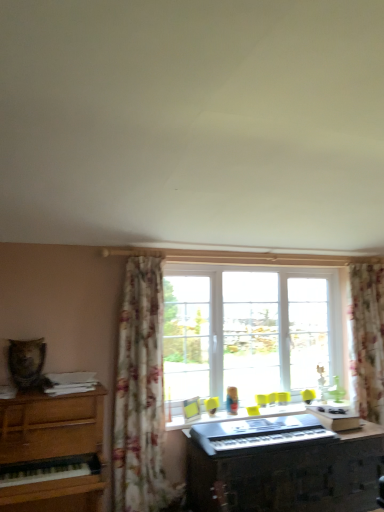
Measure the distance between point [134,438] and camera.

Point [134,438] and camera are 9.18 feet apart.

This screenshot has width=384, height=512. Describe the element at coordinates (257, 433) in the screenshot. I see `black plastic musical keyboard at center` at that location.

Describe the element at coordinates (51, 426) in the screenshot. I see `wooden piano at left` at that location.

Image resolution: width=384 pixels, height=512 pixels. In order to click on metallic silver keyboard at center in this screenshot , I will do `click(281, 466)`.

Find the location of a particular element. floral fabric curtain at right, the second curtain in the left-to-right sequence is located at coordinates coord(368,338).

Identify the location of floral fabric curtain at center, the first curtain from the front. (141, 394).

Is point (205, 328) closer to camera compared to point (134, 265)?

No, (205, 328) is further to viewer.

Could you tell me if clear glass window at center is facing floral fabric curtain at center, which is the 1th curtain in left-to-right order?

No.

Considering the sizes of objects clear glass window at center and floral fabric curtain at center, which appears as the second curtain when viewed from the right, in the image provided, who is wider, clear glass window at center or floral fabric curtain at center, which appears as the second curtain when viewed from the right,?

With larger width is clear glass window at center.

Is clear glass window at center inside or outside of floral fabric curtain at center, the 2th curtain positioned from the back?

clear glass window at center is not enclosed by floral fabric curtain at center, the 2th curtain positioned from the back.

Between metallic silver keyboard at center and clear glass window at center, which one has smaller size?

With smaller size is clear glass window at center.

Do you think metallic silver keyboard at center is within clear glass window at center, or outside of it?

metallic silver keyboard at center is outside clear glass window at center.

From a real-world perspective, is metallic silver keyboard at center on clear glass window at center?

Actually, metallic silver keyboard at center is physically below clear glass window at center in the real world.

What are the coordinates of `piano in front of the clear glass window at center` in the screenshot? It's located at (281, 466).

Does black plastic musical keyboard at center appear on the right side of wooden piano at left?

Correct, you'll find black plastic musical keyboard at center to the right of wooden piano at left.

Are black plastic musical keyboard at center and wooden piano at left located far from each other?

They are positioned close to each other.

Is black plastic musical keyboard at center positioned with its back to wooden piano at left?

That's not correct — black plastic musical keyboard at center is not looking away from wooden piano at left.

Can you confirm if black plastic musical keyboard at center is taller than wooden piano at left?

No.

Is metallic silver keyboard at center not close to floral fabric curtain at right, the first curtain in the right-to-left sequence?

Indeed, metallic silver keyboard at center is not near floral fabric curtain at right, the first curtain in the right-to-left sequence.

From the picture: Which of these two, metallic silver keyboard at center or floral fabric curtain at right, the second curtain in the left-to-right sequence, stands shorter?

Standing shorter between the two is metallic silver keyboard at center.

Is the position of metallic silver keyboard at center more distant than that of floral fabric curtain at right, the second curtain in the left-to-right sequence?

No.

Identify the location of piano below the floral fabric curtain at right, which ranks as the 2th curtain in front-to-back order (from a real-world perspective). (x=281, y=466).

Can wooden piano at left be found inside floral fabric curtain at center, the 2th curtain positioned from the back?

No, wooden piano at left is not surrounded by floral fabric curtain at center, the 2th curtain positioned from the back.

I want to click on cabinetry below the floral fabric curtain at center, which is the 1th curtain in left-to-right order (from the image's perspective), so click(x=51, y=426).

Is floral fabric curtain at center, the first curtain from the front, in front of or behind wooden piano at left in the image?

floral fabric curtain at center, the first curtain from the front, is behind wooden piano at left.

Considering the positions of points (40, 401) and (123, 466), is point (40, 401) closer to camera compared to point (123, 466)?

That is True.

From a real-world perspective, which object rests below the other?

wooden piano at left is physically lower.

Can you confirm if wooden piano at left is wider than floral fabric curtain at center, which is the 1th curtain in left-to-right order?

Indeed, wooden piano at left has a greater width compared to floral fabric curtain at center, which is the 1th curtain in left-to-right order.

From the image's perspective, which is below, wooden piano at left or floral fabric curtain at center, which appears as the second curtain when viewed from the right?

From the image's view, wooden piano at left is below.

Is clear glass window at center far from metallic silver keyboard at center?

No, clear glass window at center is not far away from metallic silver keyboard at center.

Is clear glass window at center shorter than metallic silver keyboard at center?

In fact, clear glass window at center may be taller than metallic silver keyboard at center.

Can you tell me how much clear glass window at center and metallic silver keyboard at center differ in facing direction?

The facing directions of clear glass window at center and metallic silver keyboard at center are 1.1 degrees apart.

Is clear glass window at center closer to the viewer compared to metallic silver keyboard at center?

That is False.

You are a GUI agent. You are given a task and a screenshot of the screen. Output one action in this format:
    pyautogui.click(x=<x>, y=<y>)
    Task: Click on the curtain below the clear glass window at center (from a real-world perspective)
    The width and height of the screenshot is (384, 512).
    Given the screenshot: What is the action you would take?
    pyautogui.click(x=141, y=394)

Identify the location of window above the metallic silver keyboard at center (from the image's perspective). (253, 331).

Looking at the image, which one is located further to black plastic musical keyboard at center, floral fabric curtain at right, the first curtain positioned from the back, or floral fabric curtain at center, the first curtain from the front?

Based on the image, floral fabric curtain at right, the first curtain positioned from the back, appears to be further to black plastic musical keyboard at center.

Which object lies further to the anchor point floral fabric curtain at center, the 2th curtain positioned from the back, floral fabric curtain at right, which ranks as the 2th curtain in front-to-back order, or clear glass window at center?

The object further to floral fabric curtain at center, the 2th curtain positioned from the back, is floral fabric curtain at right, which ranks as the 2th curtain in front-to-back order.

Based on the photo, considering their positions, is wooden piano at left positioned closer to floral fabric curtain at center, the 2th curtain positioned from the back, than clear glass window at center?

wooden piano at left lies closer to floral fabric curtain at center, the 2th curtain positioned from the back, than the other object.

Which object lies further to the anchor point floral fabric curtain at right, the first curtain positioned from the back, black plastic musical keyboard at center or metallic silver keyboard at center?

black plastic musical keyboard at center is positioned further to the anchor floral fabric curtain at right, the first curtain positioned from the back.

From the image, which object appears to be farther from clear glass window at center, floral fabric curtain at right, the second curtain in the left-to-right sequence, or floral fabric curtain at center, which appears as the second curtain when viewed from the right?

The object further to clear glass window at center is floral fabric curtain at center, which appears as the second curtain when viewed from the right.

From the image, which object appears to be nearer to metallic silver keyboard at center, black plastic musical keyboard at center or clear glass window at center?

The object closer to metallic silver keyboard at center is black plastic musical keyboard at center.

Looking at the image, which one is located closer to black plastic musical keyboard at center, clear glass window at center or floral fabric curtain at center, the first curtain from the front?

floral fabric curtain at center, the first curtain from the front, is closer to black plastic musical keyboard at center.

Based on their spatial positions, is metallic silver keyboard at center or floral fabric curtain at right, which ranks as the 2th curtain in front-to-back order, closer to clear glass window at center?

floral fabric curtain at right, which ranks as the 2th curtain in front-to-back order, is closer to clear glass window at center.

Locate an element on the screen. curtain situated between wooden piano at left and floral fabric curtain at right, the first curtain in the right-to-left sequence, from left to right is located at coordinates [141, 394].

Locate an element on the screen. This screenshot has width=384, height=512. window between floral fabric curtain at center, which is the 1th curtain in left-to-right order, and floral fabric curtain at right, which ranks as the 2th curtain in front-to-back order, in the horizontal direction is located at coordinates (253, 331).

Where is `musical keyboard between wooden piano at left and metallic silver keyboard at center from left to right`? This screenshot has height=512, width=384. musical keyboard between wooden piano at left and metallic silver keyboard at center from left to right is located at coordinates (257, 433).

Identify the location of curtain located between wooden piano at left and clear glass window at center in the left-right direction. (141, 394).